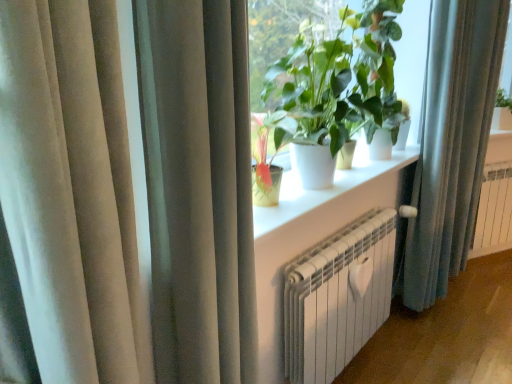
This screenshot has width=512, height=384. Identify the location of blue fabric curtain at right, placed as the first curtain when sorted from back to front. (452, 142).

Where is `green matte plant at upper center`? This screenshot has height=384, width=512. green matte plant at upper center is located at coordinates (336, 85).

You are a GUI agent. You are given a task and a screenshot of the screen. Output one action in this format:
    pyautogui.click(x=<x>, y=<y>)
    Task: Click on the white matte window sill at center
    This screenshot has height=384, width=512.
    Given the screenshot: What is the action you would take?
    pyautogui.click(x=325, y=189)

Does point (455, 206) lie behind point (248, 366)?

Yes, point (455, 206) is behind point (248, 366).

Where is `curtain behind the satin beige curtain at left, the second curtain positioned from the right`? This screenshot has height=384, width=512. curtain behind the satin beige curtain at left, the second curtain positioned from the right is located at coordinates (452, 142).

Is blue fabric curtain at right, arranged as the 2th curtain when viewed from the front, not inside satin beige curtain at left, the second curtain positioned from the right?

That's correct, blue fabric curtain at right, arranged as the 2th curtain when viewed from the front, is outside of satin beige curtain at left, the second curtain positioned from the right.

From a real-world perspective, who is located higher, blue fabric curtain at right, arranged as the 2th curtain when viewed from the front, or satin beige curtain at left, the first curtain when ordered from front to back?

In real-world perspective, satin beige curtain at left, the first curtain when ordered from front to back, is above.

Based on the photo, are satin beige curtain at left, the second curtain positioned from the right, and white metallic radiator at right located far from each other?

Yes, satin beige curtain at left, the second curtain positioned from the right, and white metallic radiator at right are located far from each other.

Which object is closer to the camera taking this photo, satin beige curtain at left, the second curtain positioned from the right, or white metallic radiator at right?

satin beige curtain at left, the second curtain positioned from the right, is more forward.

From a real-world perspective, relative to white metallic radiator at right, is satin beige curtain at left, the second curtain positioned from the right, vertically above or below?

From a real-world perspective, satin beige curtain at left, the second curtain positioned from the right, is physically above white metallic radiator at right.

From their relative heights in the image, would you say white metallic radiator at right is taller or shorter than satin beige curtain at left, marked as the second curtain in a back-to-front arrangement?

Considering their sizes, white metallic radiator at right has less height than satin beige curtain at left, marked as the second curtain in a back-to-front arrangement.

From a real-world perspective, is white metallic radiator at right positioned over satin beige curtain at left, the second curtain positioned from the right, based on gravity?

Actually, white metallic radiator at right is physically below satin beige curtain at left, the second curtain positioned from the right, in the real world.

You are a GUI agent. You are given a task and a screenshot of the screen. Output one action in this format:
    pyautogui.click(x=<x>, y=<y>)
    Task: Click on the radiator above the satin beige curtain at left, the second curtain positioned from the right (from the image's perspective)
    The height and width of the screenshot is (384, 512).
    Given the screenshot: What is the action you would take?
    pyautogui.click(x=494, y=211)

Is white metallic radiator at right further to the viewer compared to satin beige curtain at left, the first curtain when ordered from front to back?

Yes, white metallic radiator at right is further from the camera.

Could you tell me if white matte window sill at center is turned towards white metallic radiator at right?

No, white matte window sill at center is not oriented towards white metallic radiator at right.

Is white matte window sill at center behind white metallic radiator at right?

That is False.

From the image's perspective, is white matte window sill at center on top of white metallic radiator at right?

Indeed, from the image's perspective, white matte window sill at center is shown above white metallic radiator at right.

Is green matte plant at upper center touching white metallic radiator at lower center?

There is a gap between green matte plant at upper center and white metallic radiator at lower center.

Is green matte plant at upper center wider than white metallic radiator at lower center?

Yes.

From a real-world perspective, is green matte plant at upper center positioned above or below white metallic radiator at lower center?

In terms of real-world spatial position, green matte plant at upper center is above white metallic radiator at lower center.

Which object is more forward, blue fabric curtain at right, positioned as the second curtain in left-to-right order, or white matte window sill at center?

white matte window sill at center is in front.

Considering the relative positions of blue fabric curtain at right, placed as the first curtain when sorted from back to front, and white matte window sill at center in the image provided, is blue fabric curtain at right, placed as the first curtain when sorted from back to front, to the right of white matte window sill at center from the viewer's perspective?

Yes.

Who is bigger, blue fabric curtain at right, positioned as the second curtain in left-to-right order, or white matte window sill at center?

blue fabric curtain at right, positioned as the second curtain in left-to-right order.

How much distance is there between blue fabric curtain at right, which is counted as the first curtain, starting from the right, and white matte window sill at center?

blue fabric curtain at right, which is counted as the first curtain, starting from the right, and white matte window sill at center are 54.82 centimeters apart.

Who is shorter, green matte plant at upper center or white metallic radiator at right?

white metallic radiator at right is shorter.

Considering the points (289, 57) and (496, 194), which point is behind, point (289, 57) or point (496, 194)?

Positioned behind is point (496, 194).

Which of these two, green matte plant at upper center or white metallic radiator at right, is wider?

Wider between the two is green matte plant at upper center.

Where is `curtain in front of the blue fabric curtain at right, placed as the first curtain when sorted from back to front`? This screenshot has height=384, width=512. curtain in front of the blue fabric curtain at right, placed as the first curtain when sorted from back to front is located at coordinates (198, 188).

Locate an element on the screen. This screenshot has height=384, width=512. the 2nd curtain directly above the white metallic radiator at right (from a real-world perspective) is located at coordinates (198, 188).

Looking at the image, which one is located closer to white metallic radiator at right, blue fabric curtain at right, placed as the first curtain when sorted from back to front, or green matte plant at upper center?

blue fabric curtain at right, placed as the first curtain when sorted from back to front, is positioned closer to the anchor white metallic radiator at right.

Based on their spatial positions, is green matte plant at upper center or white matte window sill at center further from satin beige curtain at left, marked as the second curtain in a back-to-front arrangement?

green matte plant at upper center is positioned further to the anchor satin beige curtain at left, marked as the second curtain in a back-to-front arrangement.

Based on their spatial positions, is green matte plant at upper center or white metallic radiator at lower center further from blue fabric curtain at right, which is counted as the first curtain, starting from the right?

green matte plant at upper center is further to blue fabric curtain at right, which is counted as the first curtain, starting from the right.

Which object lies further to the anchor point white metallic radiator at right, green matte plant at upper center or white matte window sill at center?

green matte plant at upper center.

Considering their positions, is blue fabric curtain at right, which is counted as the first curtain, starting from the right, positioned further to satin beige curtain at left, the 1th curtain when ordered from left to right, than white metallic radiator at lower center?

blue fabric curtain at right, which is counted as the first curtain, starting from the right, is positioned further to the anchor satin beige curtain at left, the 1th curtain when ordered from left to right.

Estimate the real-world distances between objects in this image. Which object is further from blue fabric curtain at right, arranged as the 2th curtain when viewed from the front, green matte plant at upper center or white metallic radiator at right?

white metallic radiator at right is further to blue fabric curtain at right, arranged as the 2th curtain when viewed from the front.

Looking at the image, which one is located closer to blue fabric curtain at right, placed as the first curtain when sorted from back to front, white metallic radiator at right or white metallic radiator at lower center?

white metallic radiator at lower center.

From the picture: From the image, which object appears to be nearer to white metallic radiator at lower center, white matte window sill at center or green matte plant at upper center?

white matte window sill at center is positioned closer to the anchor white metallic radiator at lower center.

Find the location of a particular element. curtain between green matte plant at upper center and white metallic radiator at right from front to back is located at coordinates (452, 142).

Find the location of a particular element. Image resolution: width=512 pixels, height=384 pixels. heater between satin beige curtain at left, the 1th curtain when ordered from left to right, and white metallic radiator at right, along the z-axis is located at coordinates (338, 297).

I want to click on heater positioned between green matte plant at upper center and white metallic radiator at right from near to far, so click(338, 297).

Where is `curtain between satin beige curtain at left, the first curtain when ordered from front to back, and white metallic radiator at right in the front-back direction`? The width and height of the screenshot is (512, 384). curtain between satin beige curtain at left, the first curtain when ordered from front to back, and white metallic radiator at right in the front-back direction is located at coordinates (x=452, y=142).